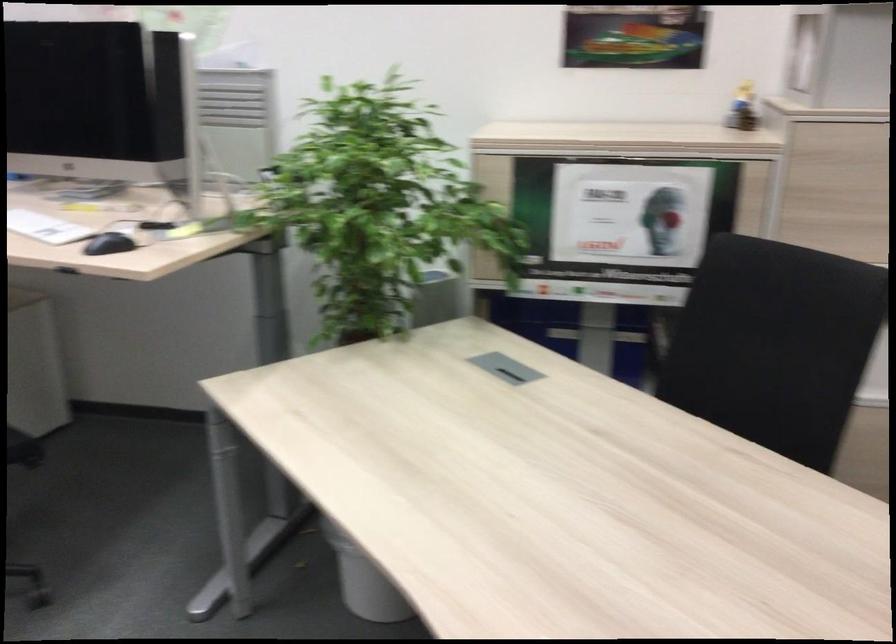
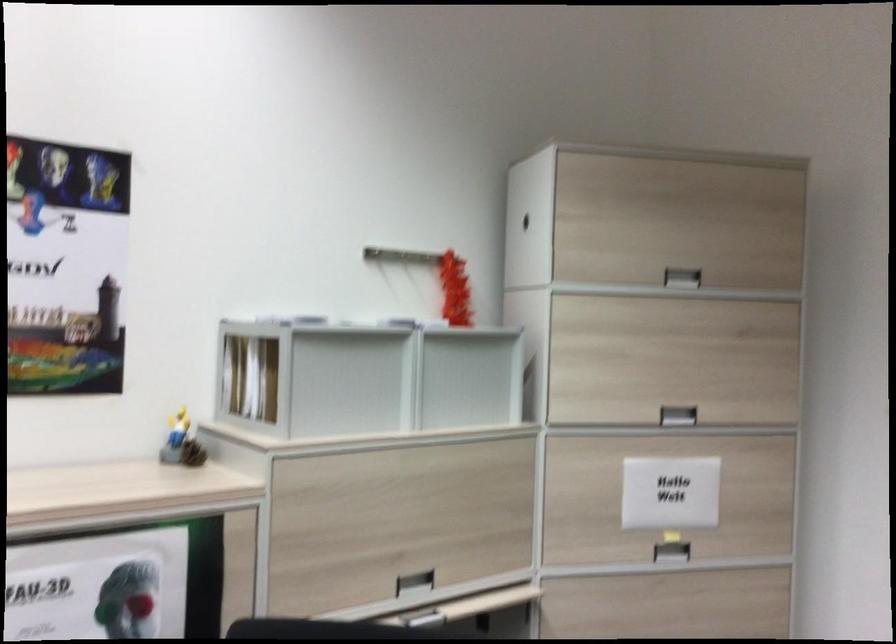
Question: The camera is either moving clockwise (left) or counter-clockwise (right) around the object. The first image is from the beginning of the video and the second image is from the end. Is the camera moving left or right when shooting the video?

Choices:
 (A) Left
 (B) Right

Answer: (A)